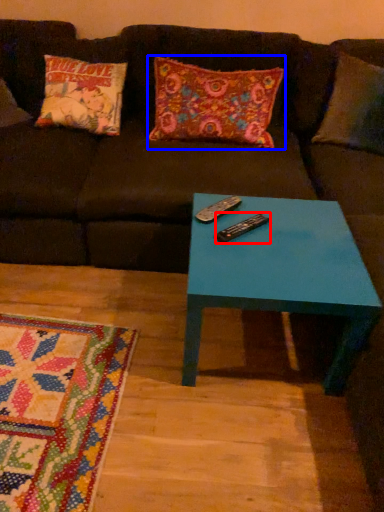
Question: Among these objects, which one is farthest to the camera, remote (highlighted by a red box) or pillow (highlighted by a blue box)?

Choices:
 (A) remote
 (B) pillow

Answer: (B)